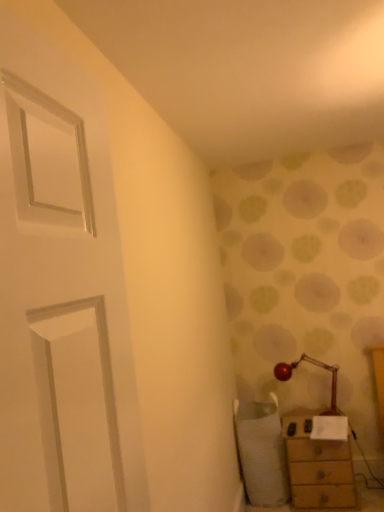
Image resolution: width=384 pixels, height=512 pixels. What do you see at coordinates (261, 452) in the screenshot? I see `white textured swivel chair at lower right` at bounding box center [261, 452].

Locate an element on the screen. metallic red table lamp at lower right is located at coordinates (315, 365).

Is metallic red table lamp at lower right positioned with its back to white textured swivel chair at lower right?

That's not correct — metallic red table lamp at lower right is not looking away from white textured swivel chair at lower right.

Is white textured swivel chair at lower right inside metallic red table lamp at lower right?

No, white textured swivel chair at lower right is not inside metallic red table lamp at lower right.

Is metallic red table lamp at lower right placed right next to white textured swivel chair at lower right?

No, metallic red table lamp at lower right is not next to white textured swivel chair at lower right.

Locate an element on the screen. This screenshot has width=384, height=512. table lamp that appears behind the white textured swivel chair at lower right is located at coordinates click(x=315, y=365).

From the image's perspective, which is above, wooden chest of drawers at lower right or white textured swivel chair at lower right?

From the image's view, white textured swivel chair at lower right is above.

Can you confirm if wooden chest of drawers at lower right is taller than white textured swivel chair at lower right?

Incorrect, the height of wooden chest of drawers at lower right is not larger of that of white textured swivel chair at lower right.

Is wooden chest of drawers at lower right oriented towards white textured swivel chair at lower right?

No.

Which of these two, white textured swivel chair at lower right or metallic red table lamp at lower right, stands taller?

With more height is white textured swivel chair at lower right.

Between white textured swivel chair at lower right and metallic red table lamp at lower right, which one has smaller width?

metallic red table lamp at lower right.

Looking at this image, is white textured swivel chair at lower right behind metallic red table lamp at lower right?

No, white textured swivel chair at lower right is in front of metallic red table lamp at lower right.

Is white textured swivel chair at lower right in contact with metallic red table lamp at lower right?

white textured swivel chair at lower right and metallic red table lamp at lower right are not in contact.

Can you tell me how much white textured swivel chair at lower right and wooden chest of drawers at lower right differ in facing direction?

There is a 1.62-degree angle between the facing directions of white textured swivel chair at lower right and wooden chest of drawers at lower right.

From a real-world perspective, who is located higher, white textured swivel chair at lower right or wooden chest of drawers at lower right?

white textured swivel chair at lower right.

Is white textured swivel chair at lower right located outside wooden chest of drawers at lower right?

Yes.

Which is behind, point (260, 463) or point (293, 434)?

The point (260, 463) is behind.

Do you think wooden chest of drawers at lower right is within metallic red table lamp at lower right, or outside of it?

wooden chest of drawers at lower right is not enclosed by metallic red table lamp at lower right.

How far apart are wooden chest of drawers at lower right and metallic red table lamp at lower right?

wooden chest of drawers at lower right and metallic red table lamp at lower right are 15.82 inches apart.

Are wooden chest of drawers at lower right and metallic red table lamp at lower right making contact?

No, wooden chest of drawers at lower right is not with metallic red table lamp at lower right.

Which of these two, wooden chest of drawers at lower right or metallic red table lamp at lower right, stands taller?

Standing taller between the two is wooden chest of drawers at lower right.

Is metallic red table lamp at lower right next to wooden chest of drawers at lower right and touching it?

There is a gap between metallic red table lamp at lower right and wooden chest of drawers at lower right.

From the image's perspective, which is below, metallic red table lamp at lower right or wooden chest of drawers at lower right?

wooden chest of drawers at lower right appears lower in the image.

Between metallic red table lamp at lower right and wooden chest of drawers at lower right, which one has larger width?

With larger width is wooden chest of drawers at lower right.

Considering the relative sizes of metallic red table lamp at lower right and wooden chest of drawers at lower right in the image provided, is metallic red table lamp at lower right bigger than wooden chest of drawers at lower right?

Actually, metallic red table lamp at lower right might be smaller than wooden chest of drawers at lower right.

The width and height of the screenshot is (384, 512). I want to click on swivel chair on the left of metallic red table lamp at lower right, so click(x=261, y=452).

Identify the location of chest of drawers that appears on the right of white textured swivel chair at lower right. (317, 465).

Considering their positions, is wooden chest of drawers at lower right positioned closer to white textured swivel chair at lower right than metallic red table lamp at lower right?

Based on the image, wooden chest of drawers at lower right appears to be nearer to white textured swivel chair at lower right.

Looking at the image, which one is located further to wooden chest of drawers at lower right, metallic red table lamp at lower right or white textured swivel chair at lower right?

Based on the image, metallic red table lamp at lower right appears to be further to wooden chest of drawers at lower right.

Estimate the real-world distances between objects in this image. Which object is further from metallic red table lamp at lower right, wooden chest of drawers at lower right or white textured swivel chair at lower right?

Among the two, white textured swivel chair at lower right is located further to metallic red table lamp at lower right.

In the scene shown: When comparing their distances from wooden chest of drawers at lower right, does white textured swivel chair at lower right or metallic red table lamp at lower right seem further?

The object further to wooden chest of drawers at lower right is metallic red table lamp at lower right.

Based on their spatial positions, is metallic red table lamp at lower right or wooden chest of drawers at lower right further from white textured swivel chair at lower right?

metallic red table lamp at lower right.

Which object lies further to the anchor point metallic red table lamp at lower right, white textured swivel chair at lower right or wooden chest of drawers at lower right?

white textured swivel chair at lower right is positioned further to the anchor metallic red table lamp at lower right.

Where is `swivel chair between metallic red table lamp at lower right and wooden chest of drawers at lower right vertically`? Image resolution: width=384 pixels, height=512 pixels. swivel chair between metallic red table lamp at lower right and wooden chest of drawers at lower right vertically is located at coordinates (261, 452).